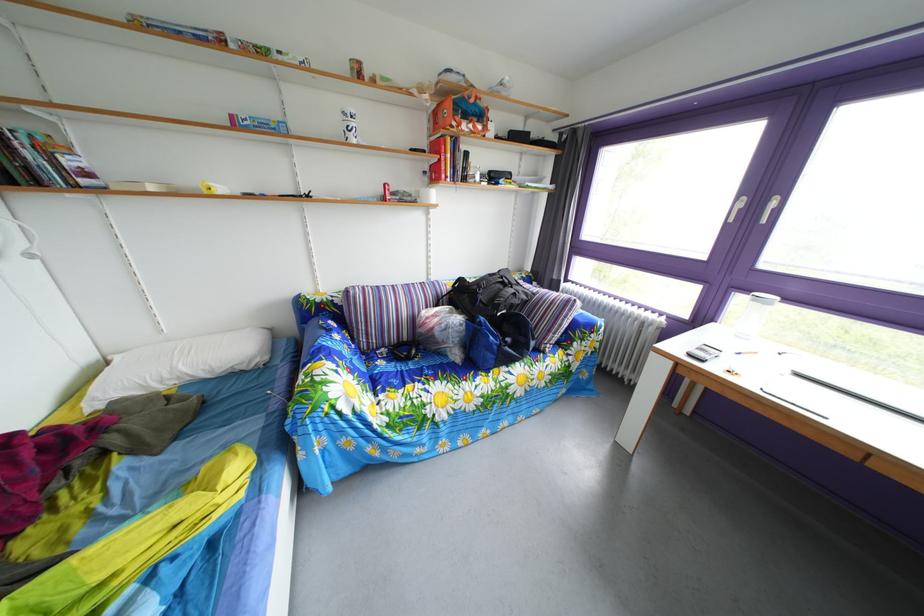
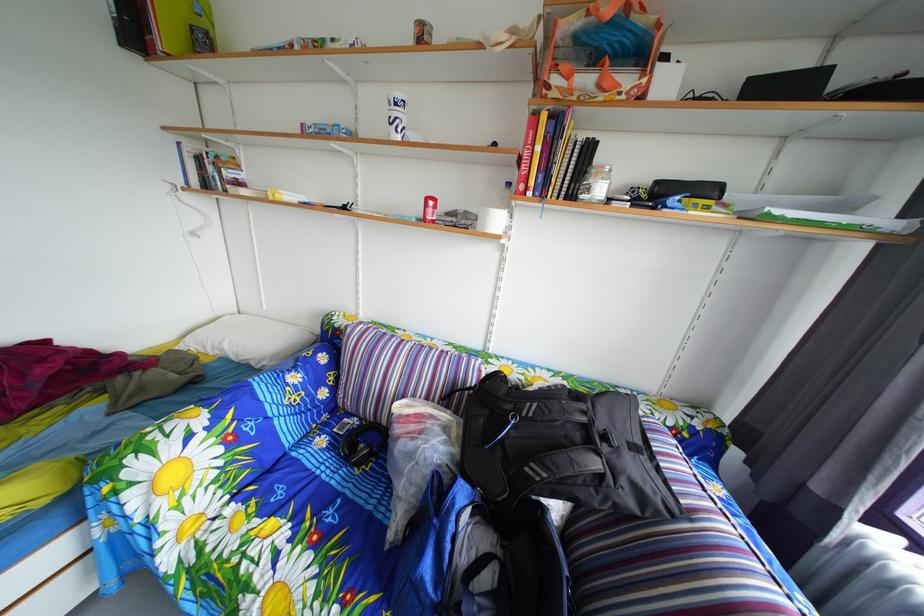
Find the pixel in the second image that matches (x=548, y=301) in the first image.

(699, 523)